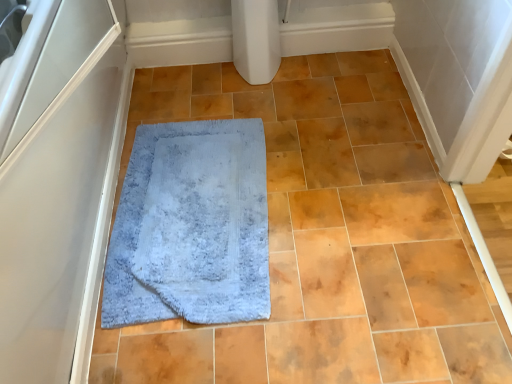
Question: Is light blue shaggy rug at center to the left or to the right of blue soft carpet at center in the image?

Choices:
 (A) right
 (B) left

Answer: (B)

Question: Is light blue shaggy rug at center bigger or smaller than blue soft carpet at center?

Choices:
 (A) small
 (B) big

Answer: (A)

Question: Which of these objects is positioned closest to the light blue shaggy rug at center?

Choices:
 (A) blue soft carpet at center
 (B) white matte screen door at left

Answer: (A)

Question: Based on their relative distances, which object is nearer to the white matte screen door at left?

Choices:
 (A) blue soft carpet at center
 (B) light blue shaggy rug at center

Answer: (B)